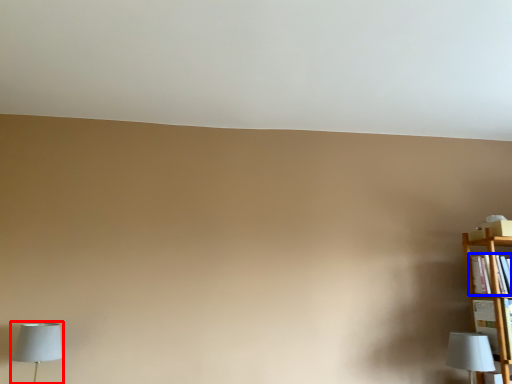
Question: Which point is further to the camera, lamp (highlighted by a red box) or book (highlighted by a blue box)?

Choices:
 (A) lamp
 (B) book

Answer: (B)